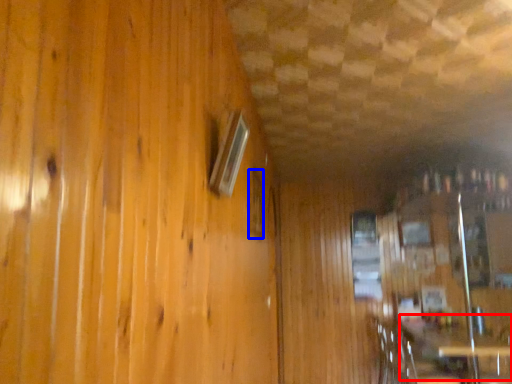
Question: Which object is closer to the camera taking this photo, table (highlighted by a red box) or window (highlighted by a blue box)?

Choices:
 (A) table
 (B) window

Answer: (B)